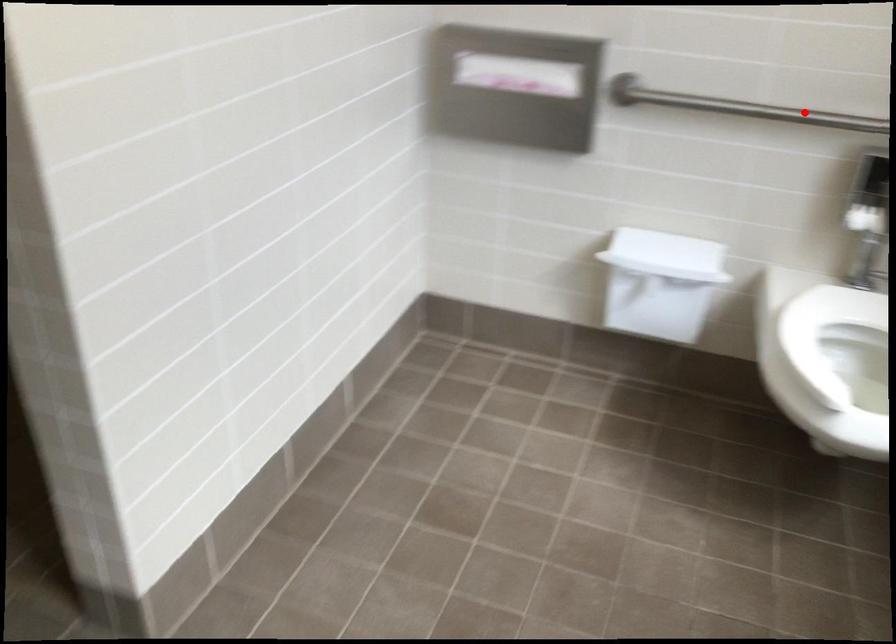
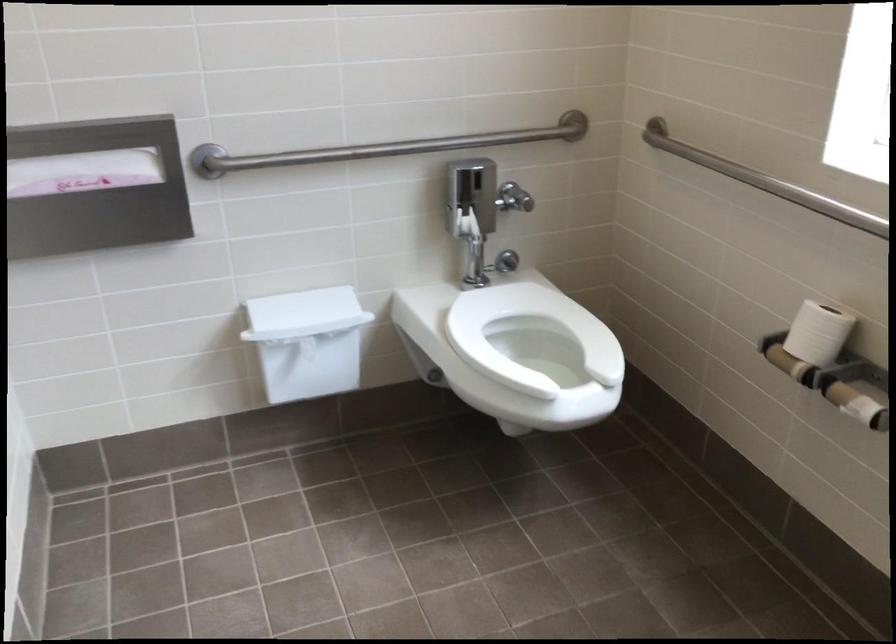
Find the pixel in the second image that matches the highlighted location in the first image.

(382, 147)